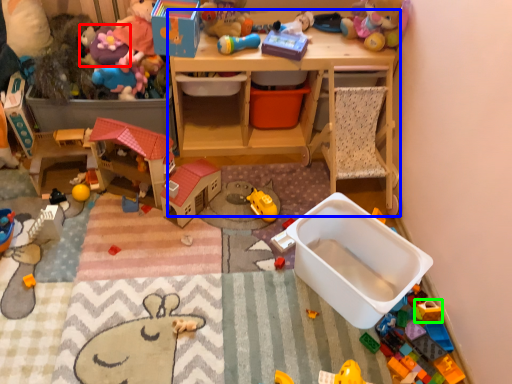
Question: Which is nearer to the toy (highlighted by a red box)? desk (highlighted by a blue box) or toy (highlighted by a green box).

Choices:
 (A) desk
 (B) toy

Answer: (A)